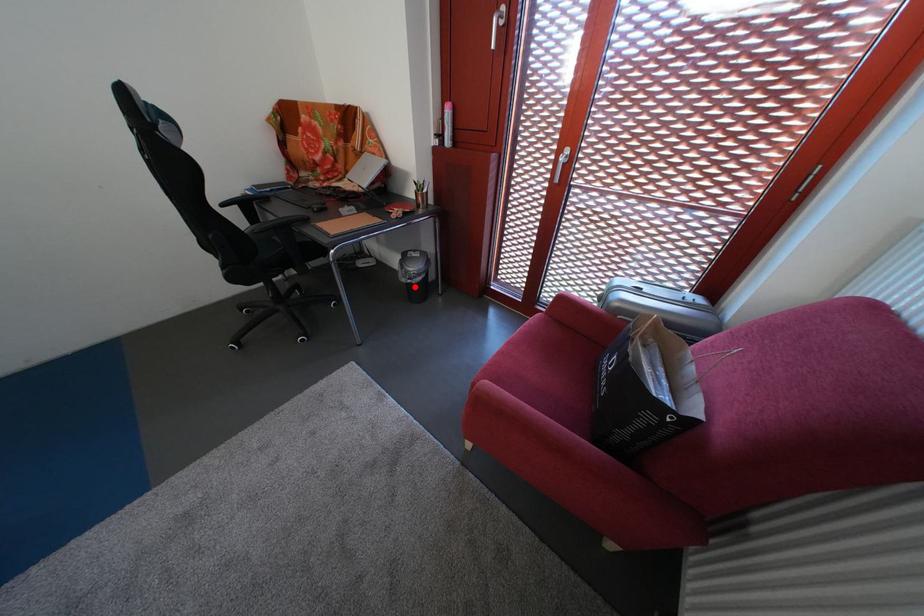
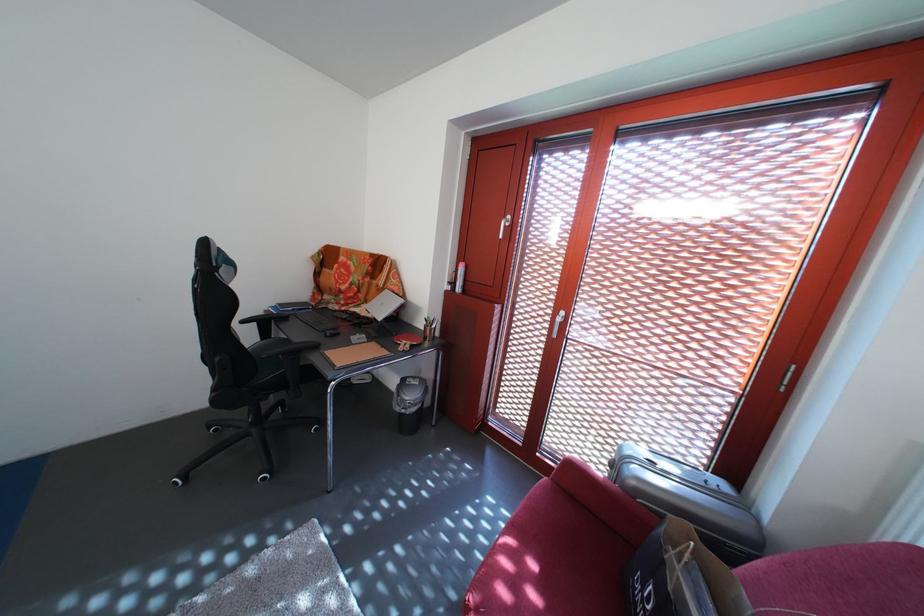
Question: A red point is marked in image1. In image2, is the corresponding 3D point closer to the camera or farther? Reply with the corresponding letter.

Choices:
 (A) The corresponding 3D point is closer.
 (B) The corresponding 3D point is farther.

Answer: (B)